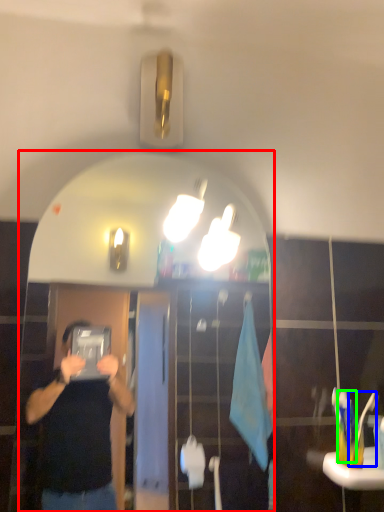
Question: Estimate the real-world distances between objects in this image. Which object is closer to mirror (highlighted by a red box), toothbrush (highlighted by a blue box) or toothbrush (highlighted by a green box)?

Choices:
 (A) toothbrush
 (B) toothbrush

Answer: (B)